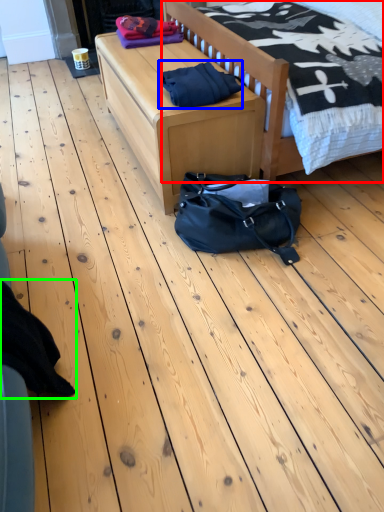
Question: Based on their relative distances, which object is farther from bed (highlighted by a red box)? Choose from material (highlighted by a blue box) and clothing (highlighted by a green box).

Choices:
 (A) material
 (B) clothing

Answer: (B)